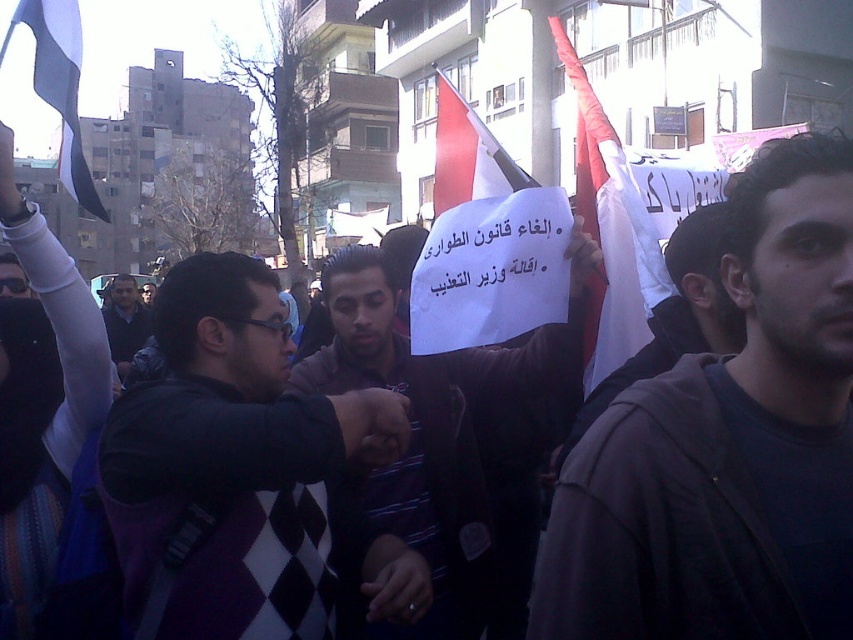
Between dark brown sweater at center and dark blue sweater at center, which one is positioned lower?

dark brown sweater at center is lower down.

Is dark brown sweater at center shorter than dark blue sweater at center?

In fact, dark brown sweater at center may be taller than dark blue sweater at center.

Measure the distance between point (469, 362) and camera.

Point (469, 362) and camera are 4.17 meters apart.

Identify the location of dark brown sweater at center. (424, 438).

Can you confirm if white paper sign at center is taller than white fabric flag at center?

No.

Who is taller, white paper sign at center or white fabric flag at center?

white fabric flag at center

Is point (624, 163) in front of point (438, 168)?

No, it is not.

At what (x,y) coordinates should I click in order to perform the action: click on white paper sign at center. Please return your answer as a coordinate pair (x, y). The image size is (853, 640). Looking at the image, I should click on (610, 230).

Between point (717, 346) and point (65, 161), which one is positioned behind?

Point (717, 346)

Does point (730, 314) come in front of point (62, 93)?

No, (730, 314) is further to viewer.

Does point (671, 237) lie behind point (94, 188)?

No, it is not.

Find the location of `dark brown leather jacket at center`. dark brown leather jacket at center is located at coordinates (675, 316).